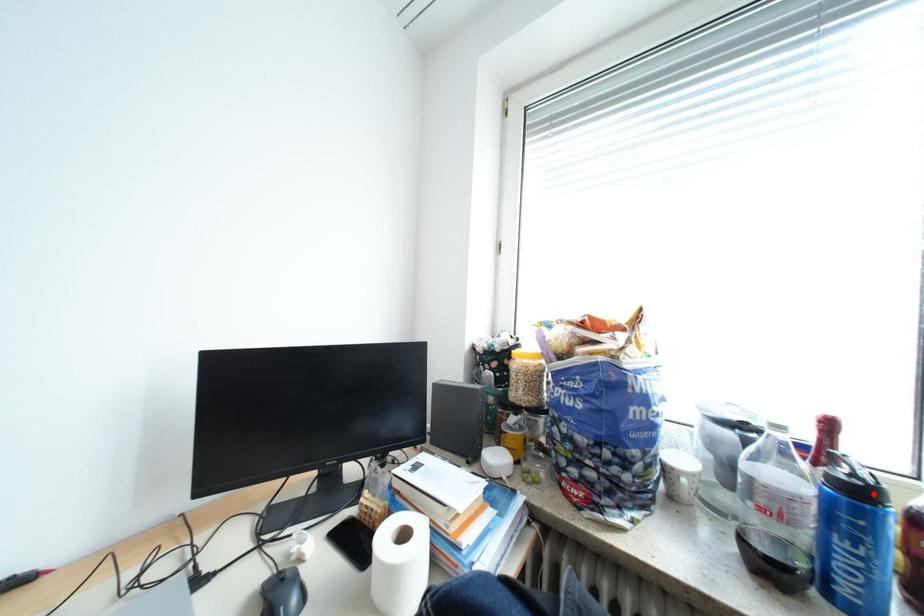
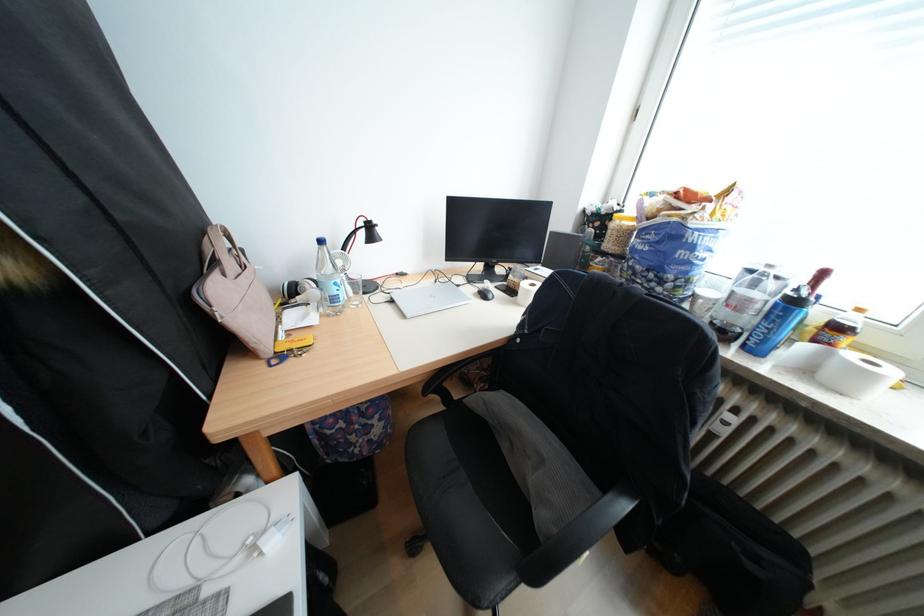
The point at the highlighted location is marked in the first image. Where is the corresponding point in the second image?

(808, 302)